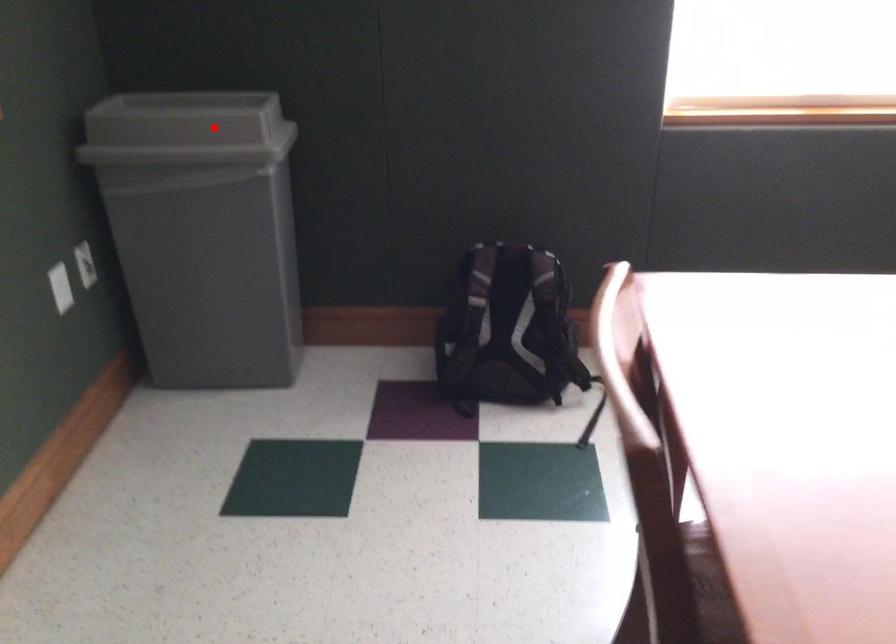
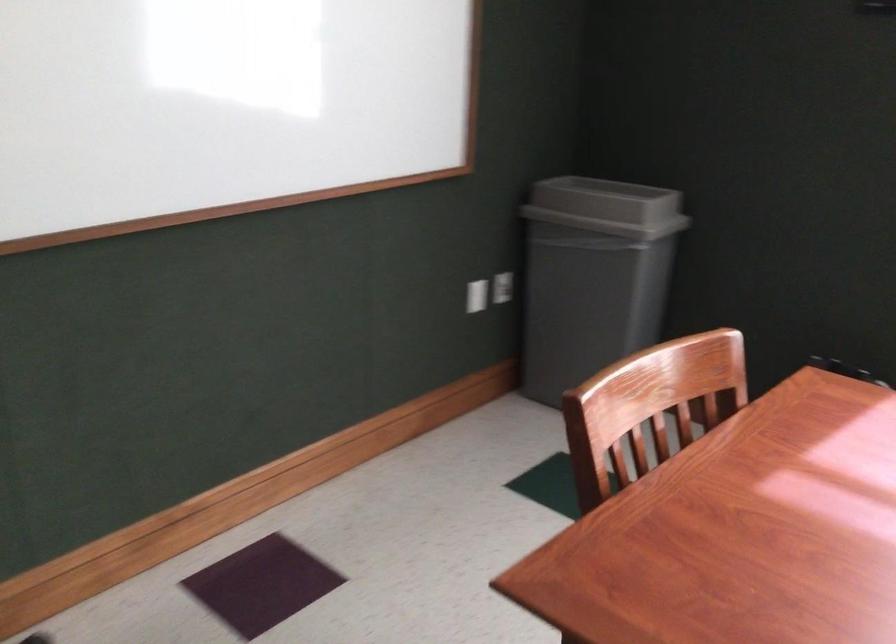
Question: I am providing you with two images of the same scene from different viewpoints. In image1, a red point is highlighted. Considering the same 3D point in image2, which of the following is correct?

Choices:
 (A) It is closer
 (B) It is farther

Answer: (B)